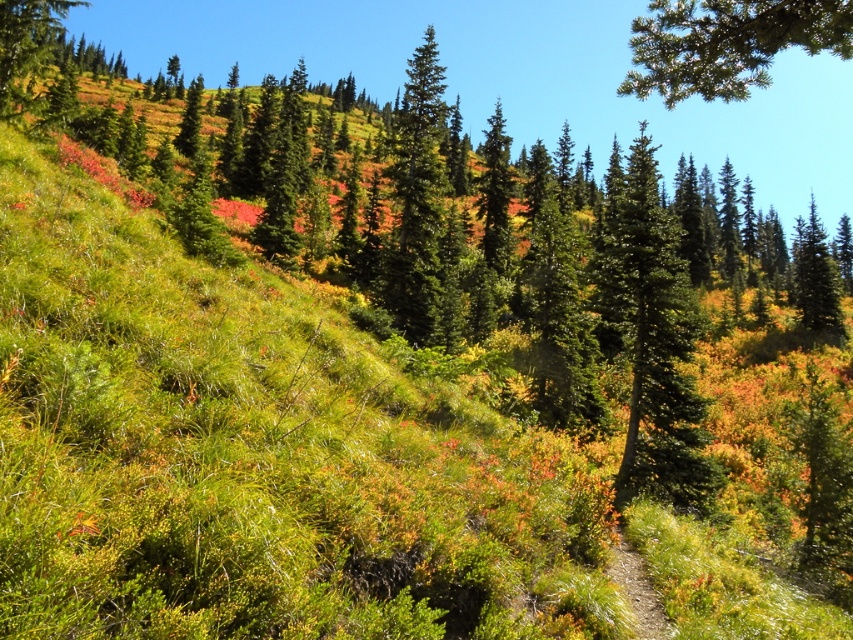
Question: Which is farther from the green matte tree at upper left?

Choices:
 (A) green needle-like at upper center
 (B) green glossy tree at center

Answer: (B)

Question: Can you confirm if green glossy tree at center is bigger than green needle-like at upper center?

Choices:
 (A) yes
 (B) no

Answer: (A)

Question: Does green needle-like at upper center appear on the left side of green matte tree at upper left?

Choices:
 (A) yes
 (B) no

Answer: (B)

Question: Which point is closer to the camera?

Choices:
 (A) green needle-like at upper center
 (B) green matte tree at upper left
 (C) green glossy tree at center

Answer: (A)

Question: Which of these objects is positioned farthest from the green matte tree at upper left?

Choices:
 (A) green glossy tree at center
 (B) green needle-like at upper center

Answer: (A)

Question: Is the position of green glossy tree at center more distant than that of green needle-like at upper center?

Choices:
 (A) yes
 (B) no

Answer: (A)